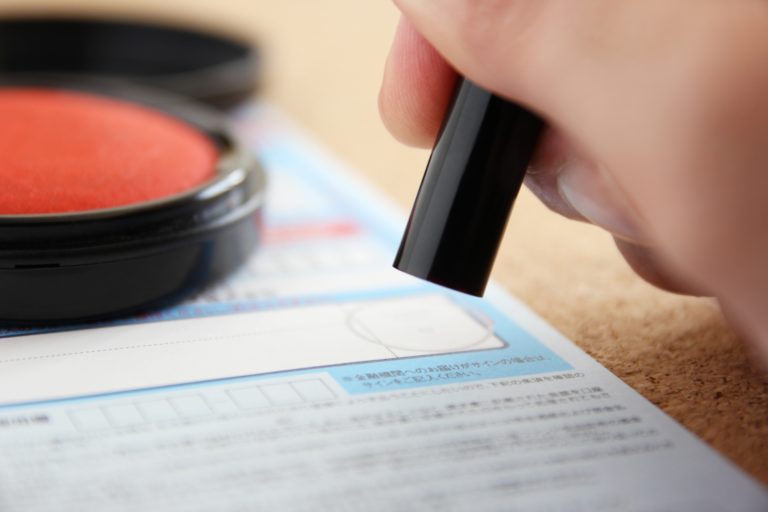
Image resolution: width=768 pixels, height=512 pixels. Find the location of `pen or marker`. pen or marker is located at coordinates (468, 206).